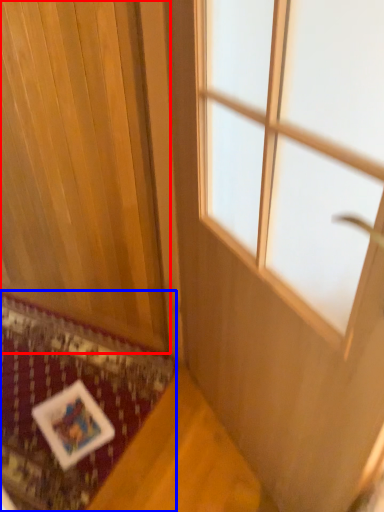
Question: Which point is further to the camera, curtain (highlighted by a red box) or mat (highlighted by a blue box)?

Choices:
 (A) curtain
 (B) mat

Answer: (B)